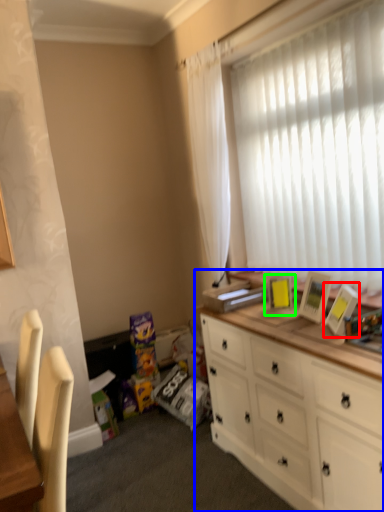
Question: Which is nearer to the picture frame (highlighted by a red box)? cabinetry (highlighted by a blue box) or picture frame (highlighted by a green box).

Choices:
 (A) cabinetry
 (B) picture frame

Answer: (B)